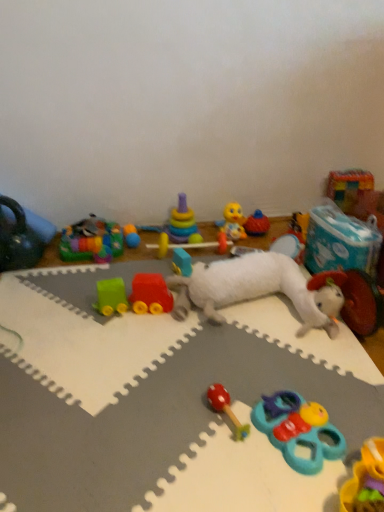
You are a GUI agent. You are given a task and a screenshot of the screen. Output one action in this format:
    pyautogui.click(x=<x>, y=<y>)
    Task: Click on the free spot to the right of matte black kettlebell at left, the first toy from the left
    
    Given the screenshot: What is the action you would take?
    pyautogui.click(x=68, y=267)